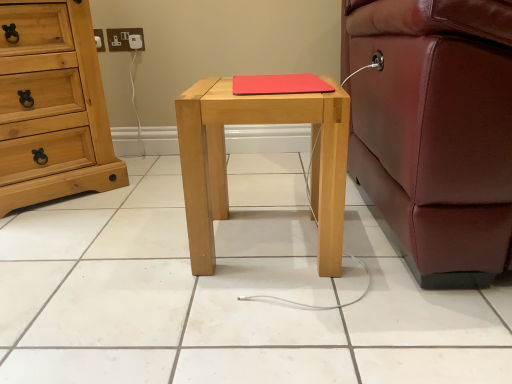
Where is `vacant space to the right of light wood/texture nightstand at center`? This screenshot has height=384, width=512. vacant space to the right of light wood/texture nightstand at center is located at coordinates (382, 251).